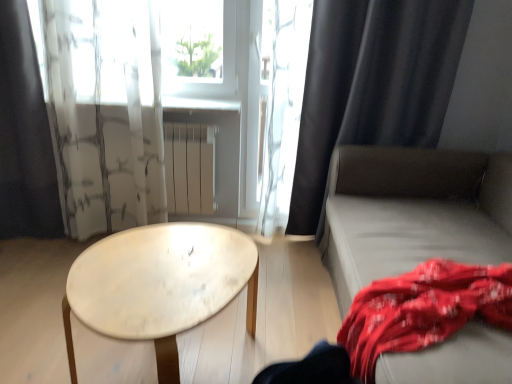
Question: From their relative heights in the image, would you say black fabric curtain at left, arranged as the 1th curtain when viewed from the left, is taller or shorter than white matte radiator at center?

Choices:
 (A) short
 (B) tall

Answer: (B)

Question: From a real-world perspective, is black fabric curtain at left, arranged as the 1th curtain when viewed from the left, positioned above or below white matte radiator at center?

Choices:
 (A) below
 (B) above

Answer: (B)

Question: Which of these objects is positioned closest to the red cotton blanket at lower right?

Choices:
 (A) transparent glass window screen at upper center
 (B) light gray fabric couch at right
 (C) white marble table at center
 (D) black matte curtain at right, the third curtain viewed from the left
 (E) white matte radiator at center

Answer: (B)

Question: Which of these objects is positioned farthest from the light gray fabric couch at right?

Choices:
 (A) black matte curtain at right, the third curtain viewed from the left
 (B) translucent white curtain at upper center, which ranks as the 2th curtain in left-to-right order
 (C) black fabric curtain at left, the third curtain when ordered from right to left
 (D) white matte radiator at center
 (E) white marble table at center

Answer: (C)